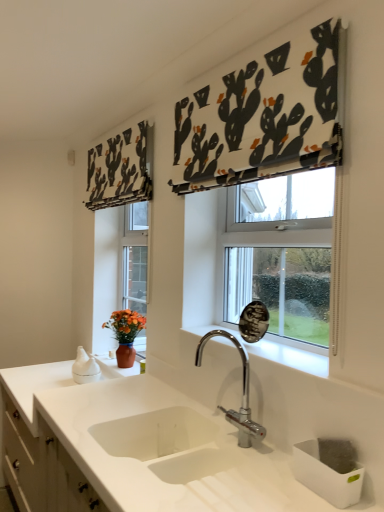
Find the location of a particular element. This screenshot has width=384, height=512. free space above white fabric with cactus print at upper center, acting as the second curtain starting from the back (from a real-world perspective) is located at coordinates (260, 45).